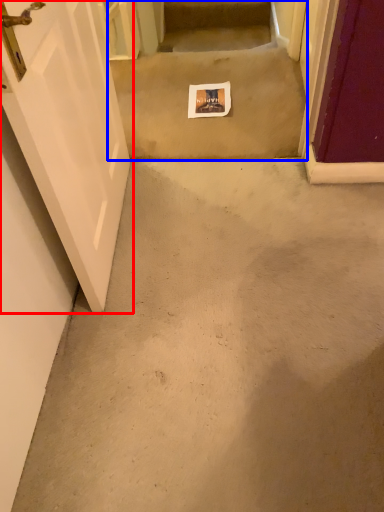
Question: Which point is further to the camera, door (highlighted by a red box) or stairwell (highlighted by a blue box)?

Choices:
 (A) door
 (B) stairwell

Answer: (B)